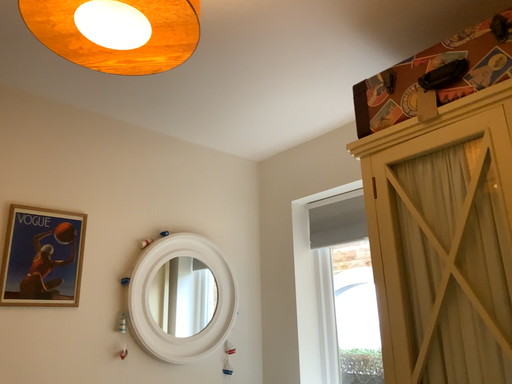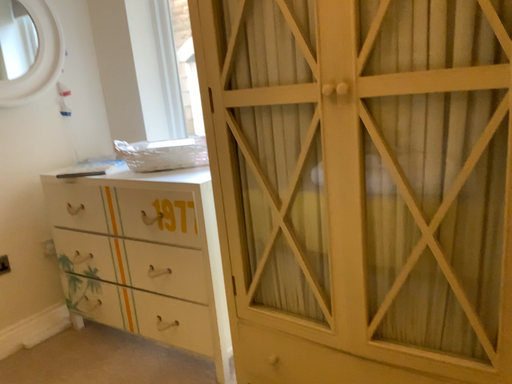
Question: How did the camera likely rotate when shooting the video?

Choices:
 (A) rotated left
 (B) rotated right

Answer: (B)